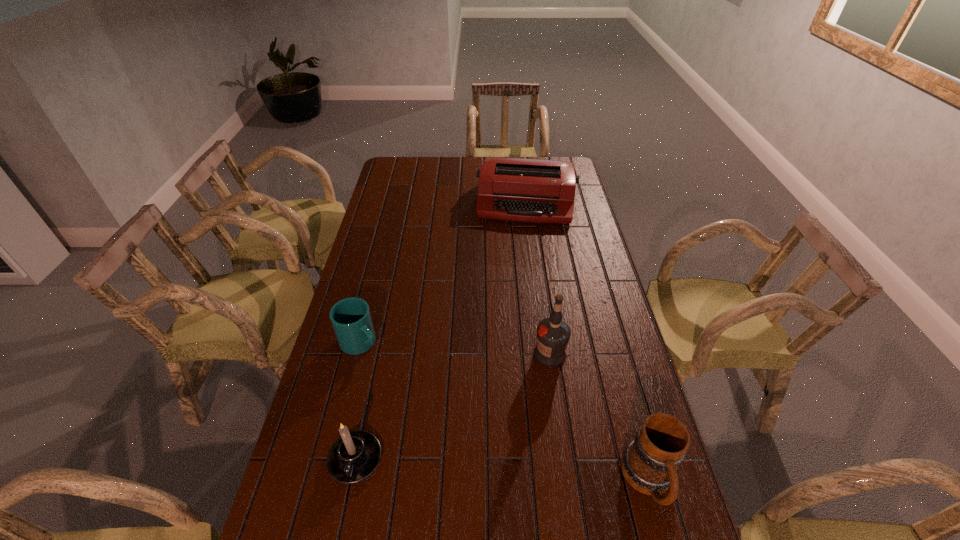
This screenshot has height=540, width=960. Identify the location of vacant space located 0.070m on the handle side of the cup. (390, 364).

The image size is (960, 540). I want to click on free point located 0.220m on the handle side of the cup, so coord(425,393).

Identify the location of free space located on the typing side of the farthest object. The image size is (960, 540). (523, 235).

Where is `free space located 0.330m on the typing side of the farthest object`? The image size is (960, 540). free space located 0.330m on the typing side of the farthest object is located at coordinates (519, 281).

Where is `free space located 0.370m on the typing side of the farthest object`? The width and height of the screenshot is (960, 540). free space located 0.370m on the typing side of the farthest object is located at coordinates (518, 288).

This screenshot has height=540, width=960. Find the location of `object located at the far edge`. object located at the far edge is located at coordinates (526, 190).

Locate an element on the screen. This screenshot has height=540, width=960. object that is at the near edge is located at coordinates (649, 463).

This screenshot has height=540, width=960. Find the location of `candle holder at the left edge`. candle holder at the left edge is located at coordinates (354, 456).

Locate an element on the screen. The image size is (960, 540). cup situated at the left edge is located at coordinates (351, 319).

Image resolution: width=960 pixels, height=540 pixels. I want to click on mug present at the right edge, so click(x=649, y=463).